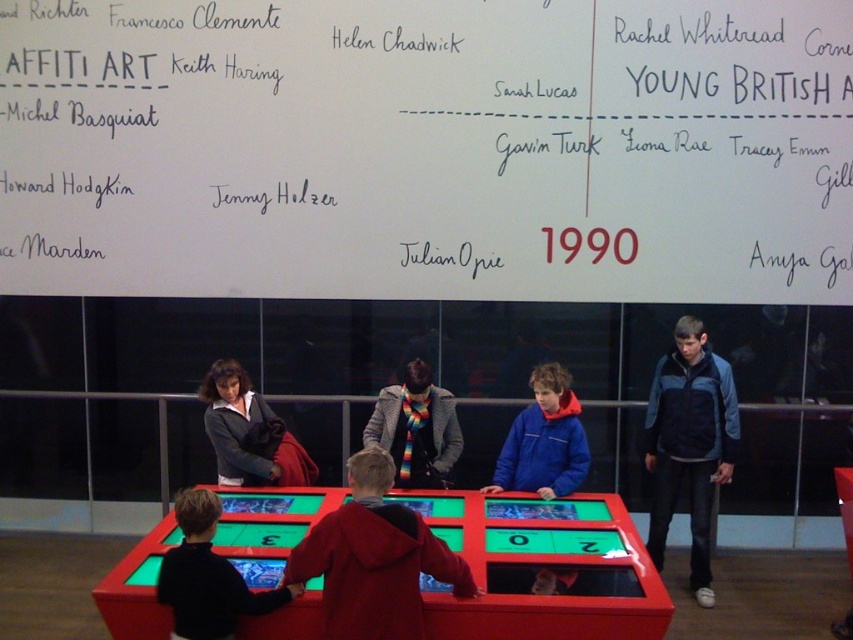
Which of these two, red hoodie at center or black sweater at lower left, stands taller?

red hoodie at center is taller.

The height and width of the screenshot is (640, 853). I want to click on red hoodie at center, so click(x=374, y=557).

Which is behind, point (309, 532) or point (193, 579)?

Positioned behind is point (309, 532).

This screenshot has height=640, width=853. Find the location of `red hoodie at center`. red hoodie at center is located at coordinates (374, 557).

Between white paper at upper center and blue fleece jacket at center, which one appears on the left side from the viewer's perspective?

Positioned to the left is white paper at upper center.

Describe the element at coordinates (427, 148) in the screenshot. I see `white paper at upper center` at that location.

Does point (355, 125) lie in front of point (515, 467)?

No, (355, 125) is behind (515, 467).

Locate an element on the screen. white paper at upper center is located at coordinates (427, 148).

Does red hoodie at center come in front of blue fleece jacket at center?

Yes.

Is red hoodie at center to the right of blue fleece jacket at center from the viewer's perspective?

No, red hoodie at center is not to the right of blue fleece jacket at center.

At what (x,y) coordinates should I click in order to perform the action: click on red hoodie at center. Please return your answer as a coordinate pair (x, y). The width and height of the screenshot is (853, 640). Looking at the image, I should click on (374, 557).